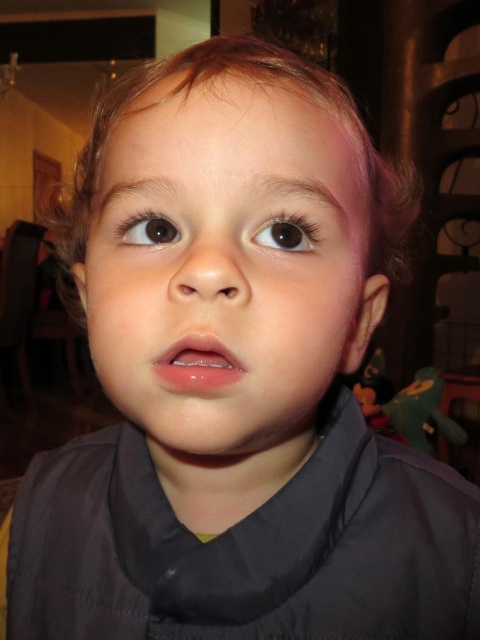
Question: Which of the following is the farthest from the observer?

Choices:
 (A) (51, 221)
 (B) (205, 449)

Answer: (A)

Question: Based on their relative distances, which object is nearer to the brown glossy eye at upper center?

Choices:
 (A) blonde curly hair at center
 (B) brown glossy eye at upper left
 (C) smooth skin face at center

Answer: (B)

Question: Which object is the closest to the brown glossy eye at upper center?

Choices:
 (A) brown glossy eye at upper left
 (B) blonde curly hair at center

Answer: (A)

Question: Does smooth skin face at center have a larger size compared to blonde curly hair at center?

Choices:
 (A) no
 (B) yes

Answer: (A)

Question: Is blonde curly hair at center thinner than brown glossy eye at upper center?

Choices:
 (A) yes
 (B) no

Answer: (B)

Question: Does brown glossy eye at upper center appear on the left side of brown glossy eye at upper left?

Choices:
 (A) yes
 (B) no

Answer: (B)